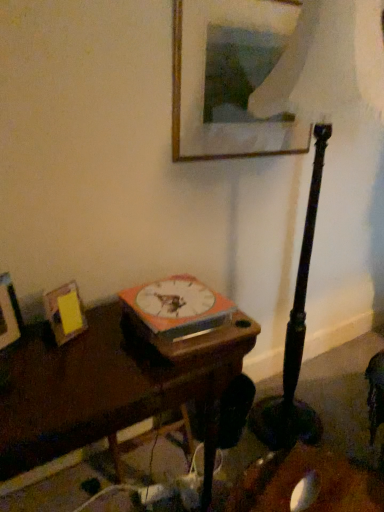
The width and height of the screenshot is (384, 512). Identify the location of free location above orange matte book at center (from a real-world perspective). (169, 296).